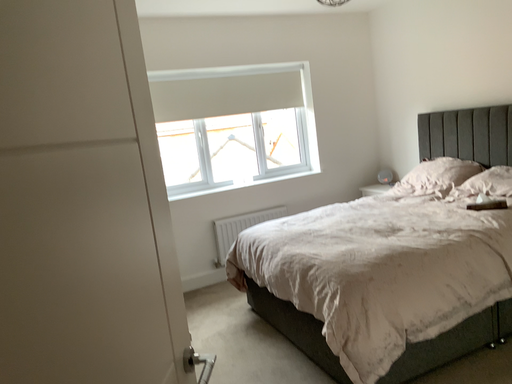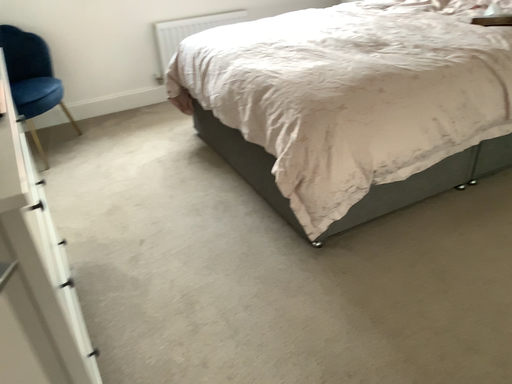
Question: Which way did the camera rotate in the video?

Choices:
 (A) rotated downward
 (B) rotated upward

Answer: (A)